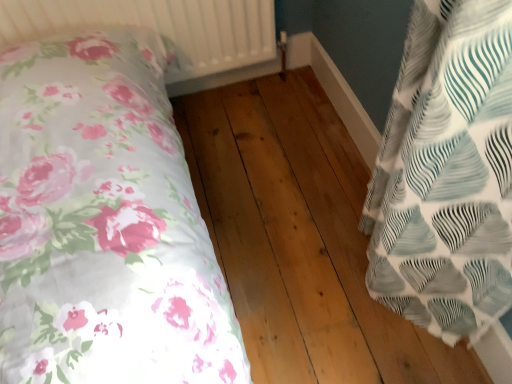
Question: From a real-world perspective, is natural wood floor at center above or below white textured fabric pillow at right?

Choices:
 (A) above
 (B) below

Answer: (B)

Question: Considering the positions of natural wood floor at center and white textured fabric pillow at right in the image, is natural wood floor at center wider or thinner than white textured fabric pillow at right?

Choices:
 (A) thin
 (B) wide

Answer: (B)

Question: Considering the real-world distances, which object is closest to the natural wood floor at center?

Choices:
 (A) white textured radiator at upper center
 (B) white textured fabric pillow at right

Answer: (B)

Question: Considering the real-world distances, which object is farthest from the white textured radiator at upper center?

Choices:
 (A) white textured fabric pillow at right
 (B) natural wood floor at center

Answer: (A)